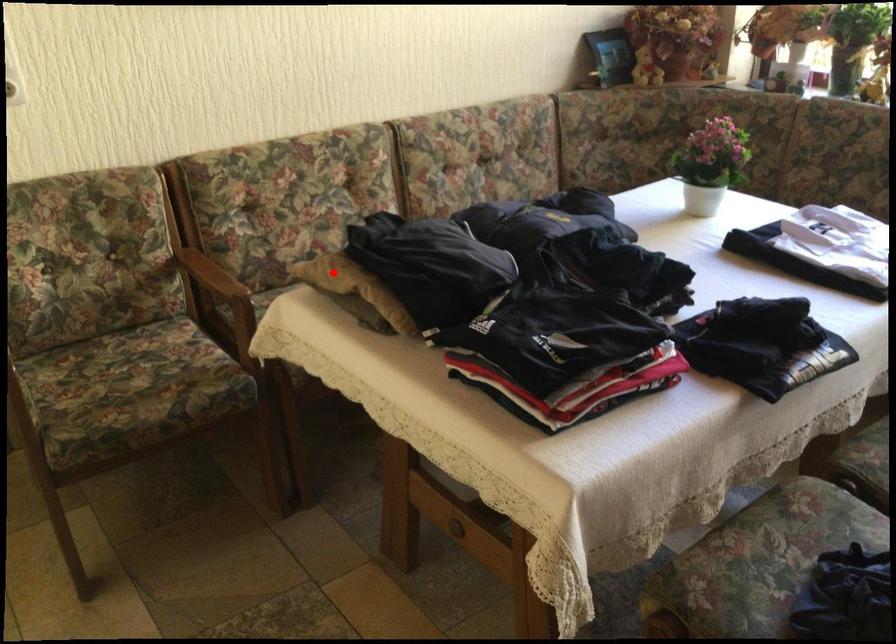
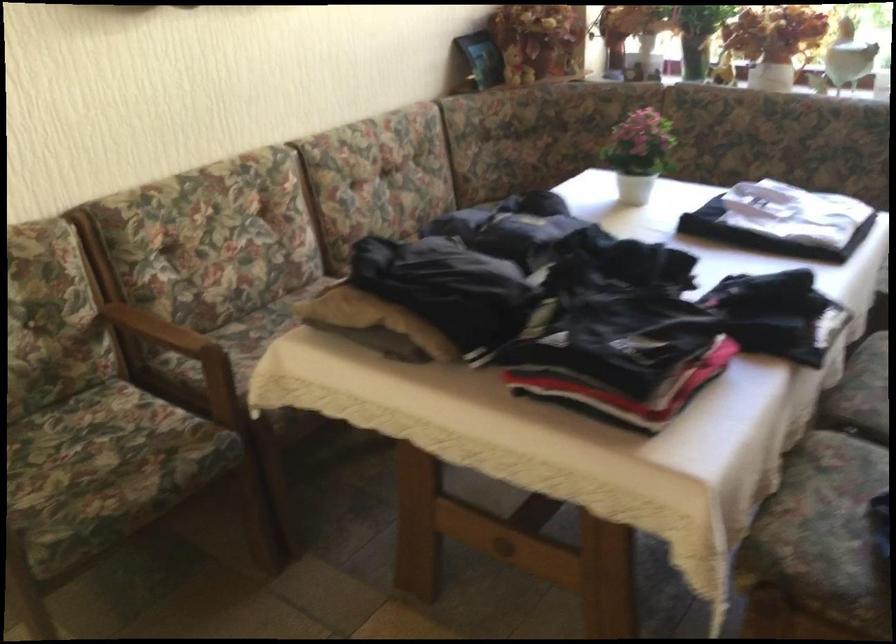
In the second image, find the point that corresponds to the highlighted location in the first image.

(351, 307)